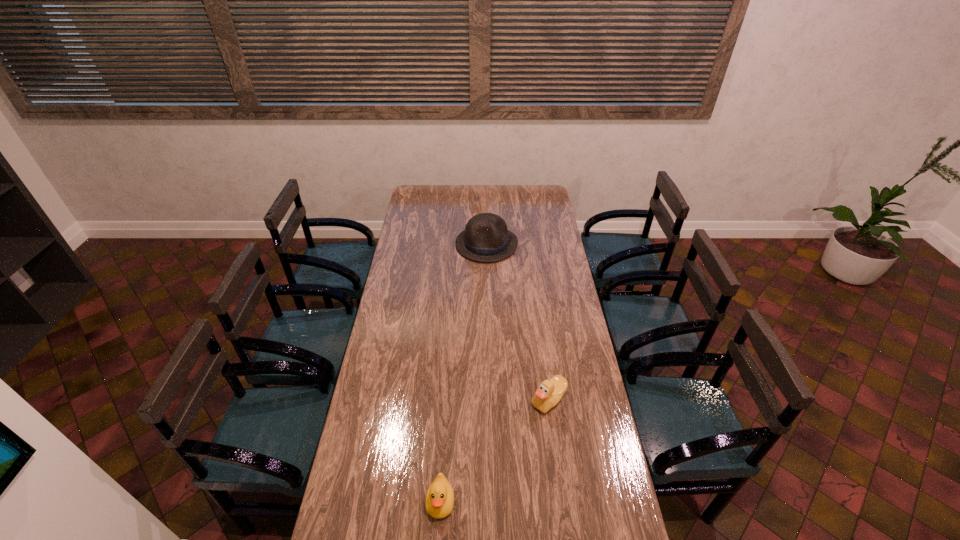
Find the location of a particular element. This screenshot has width=960, height=540. the farthest object is located at coordinates (485, 239).

At what (x,y) coordinates should I click in order to perform the action: click on bowler hat. Please return your answer as a coordinate pair (x, y). The height and width of the screenshot is (540, 960). Looking at the image, I should click on (485, 239).

The width and height of the screenshot is (960, 540). I want to click on the farther duck, so click(548, 394).

The height and width of the screenshot is (540, 960). I want to click on the right duck, so click(548, 394).

The width and height of the screenshot is (960, 540). Identify the location of the left duck. (439, 502).

You are a GUI agent. You are given a task and a screenshot of the screen. Output one action in this format:
    pyautogui.click(x=<x>, y=<y>)
    Task: Click on the nearest object
    
    Given the screenshot: What is the action you would take?
    pyautogui.click(x=439, y=502)

Where is `vacant area located 0.270m on the front-facing side of the bowler hat`? The width and height of the screenshot is (960, 540). vacant area located 0.270m on the front-facing side of the bowler hat is located at coordinates (488, 301).

Where is `free space located at the beak of the farther duck`? The image size is (960, 540). free space located at the beak of the farther duck is located at coordinates (423, 400).

In order to click on vacant space located 0.280m at the beak of the farther duck in this screenshot , I will do `click(455, 400)`.

This screenshot has height=540, width=960. What are the coordinates of `vacant space located at the beak of the farther duck` in the screenshot? It's located at (488, 400).